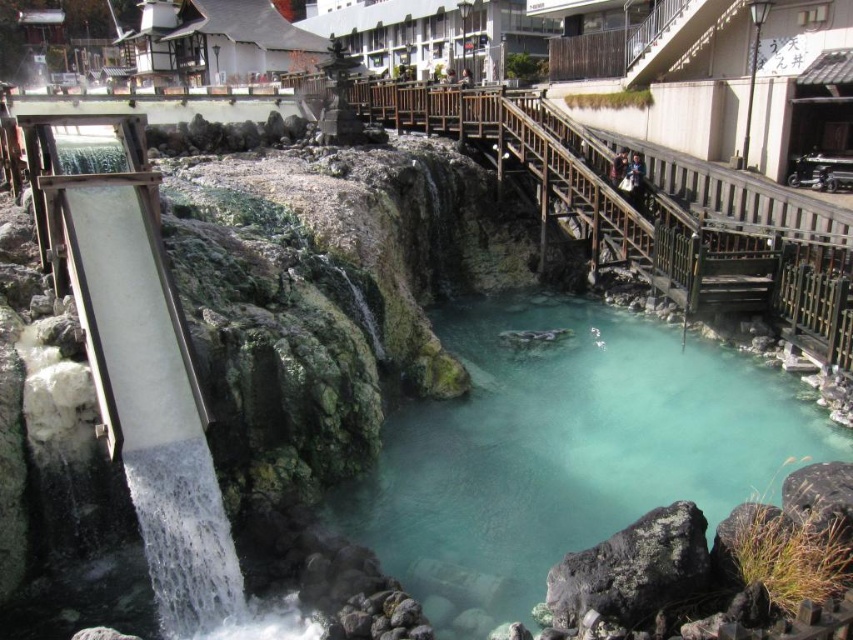
Is turquoise stone water at center smaller than white concrete waterfall at left?

No, turquoise stone water at center is not smaller than white concrete waterfall at left.

Between turquoise stone water at center and white concrete waterfall at left, which one is positioned higher?

Positioned higher is white concrete waterfall at left.

Describe the element at coordinates (566, 451) in the screenshot. The width and height of the screenshot is (853, 640). I see `turquoise stone water at center` at that location.

Image resolution: width=853 pixels, height=640 pixels. I want to click on turquoise stone water at center, so click(566, 451).